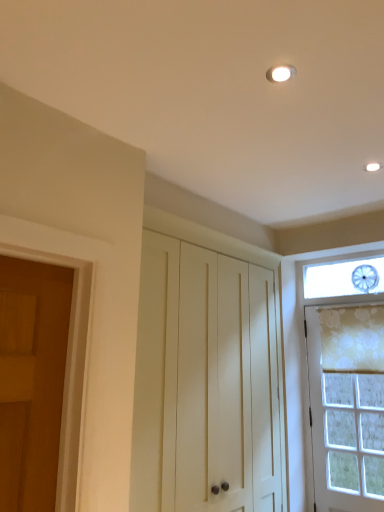
Question: Does floral fabric curtain at right lie behind white wood cabinet at center?

Choices:
 (A) no
 (B) yes

Answer: (B)

Question: Could you tell me if floral fabric curtain at right is turned towards white wood cabinet at center?

Choices:
 (A) no
 (B) yes

Answer: (B)

Question: Is floral fabric curtain at right taller than white wood cabinet at center?

Choices:
 (A) yes
 (B) no

Answer: (B)

Question: Can you confirm if floral fabric curtain at right is bigger than white wood cabinet at center?

Choices:
 (A) yes
 (B) no

Answer: (B)

Question: From the image's perspective, is floral fabric curtain at right on white wood cabinet at center?

Choices:
 (A) no
 (B) yes

Answer: (B)

Question: Relative to white textured door at right, is floral fabric curtain at right in front or behind?

Choices:
 (A) behind
 (B) front

Answer: (A)

Question: Looking at their shapes, would you say floral fabric curtain at right is wider or thinner than white textured door at right?

Choices:
 (A) thin
 (B) wide

Answer: (A)

Question: Is floral fabric curtain at right situated inside white textured door at right or outside?

Choices:
 (A) inside
 (B) outside

Answer: (A)

Question: From the image's perspective, is floral fabric curtain at right above or below white textured door at right?

Choices:
 (A) below
 (B) above

Answer: (B)

Question: Is white wood cabinet at center taller or shorter than white textured door at right?

Choices:
 (A) short
 (B) tall

Answer: (B)

Question: From a real-world perspective, is white wood cabinet at center above or below white textured door at right?

Choices:
 (A) above
 (B) below

Answer: (A)

Question: Is point (188, 487) positioned closer to the camera than point (332, 489)?

Choices:
 (A) farther
 (B) closer

Answer: (B)

Question: Is white wood cabinet at center to the left or to the right of white textured door at right in the image?

Choices:
 (A) right
 (B) left

Answer: (B)

Question: From a real-world perspective, is white wood cabinet at center above or below floral fabric curtain at right?

Choices:
 (A) above
 (B) below

Answer: (B)

Question: In terms of size, does white wood cabinet at center appear bigger or smaller than floral fabric curtain at right?

Choices:
 (A) small
 (B) big

Answer: (B)